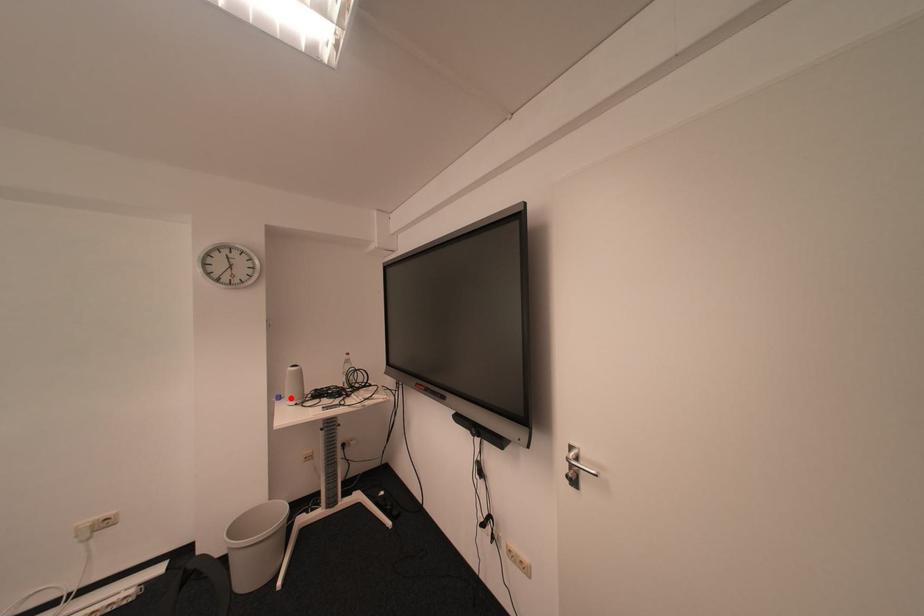
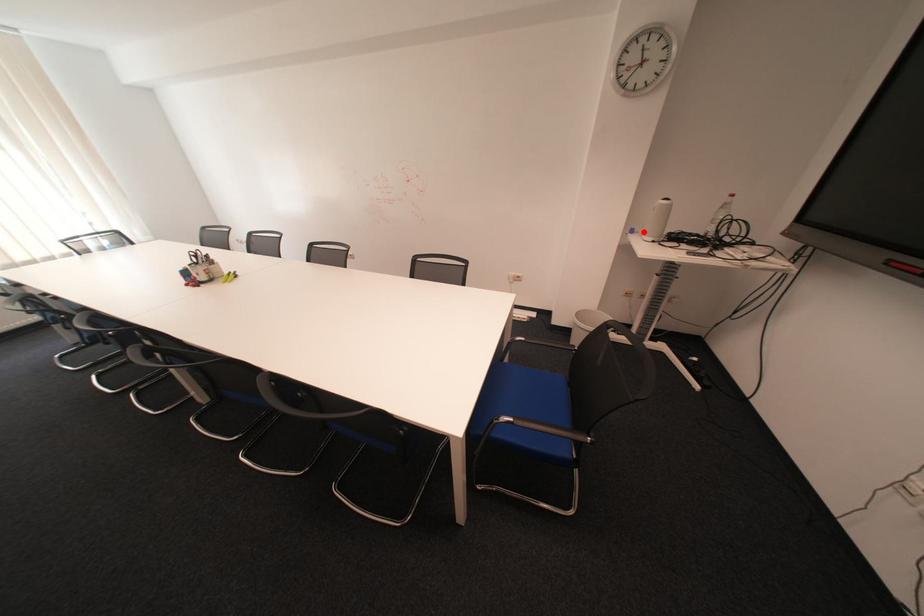
Consider the image. I am providing you with two images of the same scene from different viewpoints. A red point is marked on the first image and another point is marked on the second image. Are the points marked in image1 and image2 representing the same 3D position?

Yes